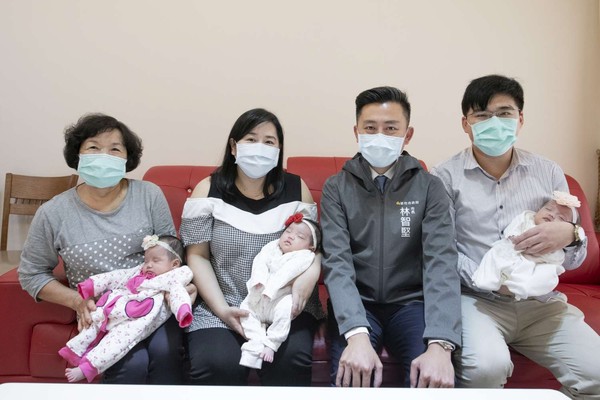
The height and width of the screenshot is (400, 600). What are the coordinates of `chair` in the screenshot? It's located at (182, 179).